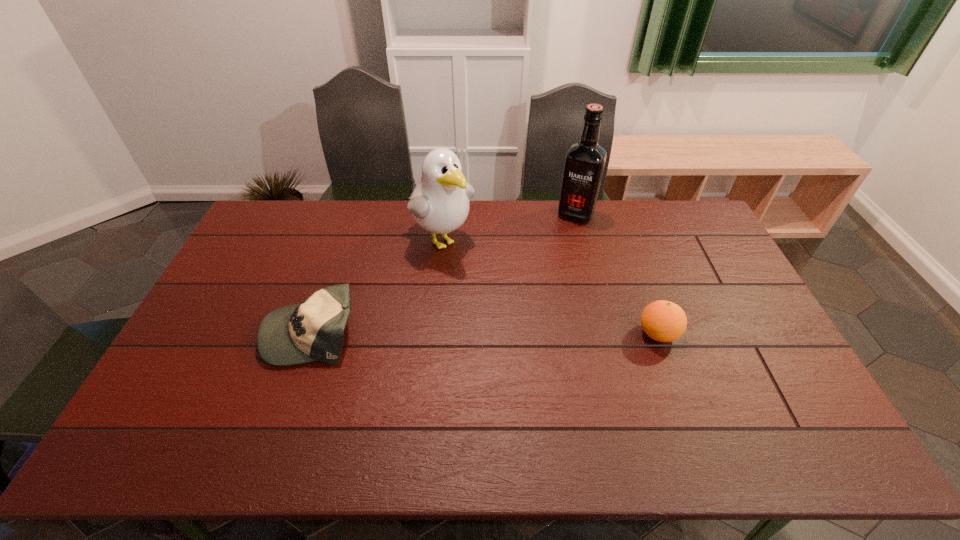
In order to click on the leftmost object in this screenshot , I will do `click(311, 331)`.

This screenshot has width=960, height=540. In order to click on the rightmost object in this screenshot , I will do `click(664, 321)`.

The image size is (960, 540). In order to click on the third object from left to right in this screenshot , I will do `click(584, 164)`.

Locate an element on the screen. This screenshot has height=540, width=960. the third shortest object is located at coordinates (439, 203).

At what (x,y) coordinates should I click in order to perform the action: click on the third object from right to left. Please return your answer as a coordinate pair (x, y). Image resolution: width=960 pixels, height=540 pixels. Looking at the image, I should click on (439, 203).

I want to click on free spot located on the front-facing side of the leftmost object, so click(243, 332).

Where is `blank space located 0.050m on the front-facing side of the leftmost object`? The width and height of the screenshot is (960, 540). blank space located 0.050m on the front-facing side of the leftmost object is located at coordinates (250, 332).

Locate an element on the screen. vacant space located 0.180m on the front-facing side of the leftmost object is located at coordinates (204, 332).

You are a GUI agent. You are given a task and a screenshot of the screen. Output one action in this format:
    pyautogui.click(x=<x>, y=<y>)
    Task: Click on the free location located on the left of the orange
    This screenshot has height=540, width=960.
    Given the screenshot: What is the action you would take?
    pyautogui.click(x=567, y=334)

The image size is (960, 540). What are the coordinates of `free spot located on the front-facing side of the second object from right to left` in the screenshot? It's located at (558, 252).